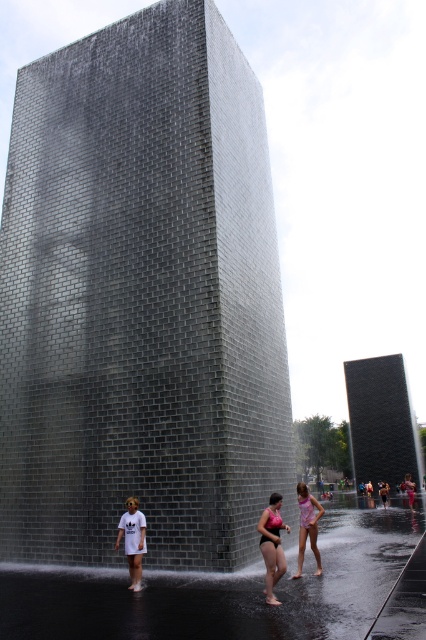
You are a photographer trying to capture the interaction between the clear water at lower center and the pink matte swimsuit at center. Based on their positions, which object is positioned to the right of the other?

The clear water at lower center is to the right of the pink matte swimsuit at center.